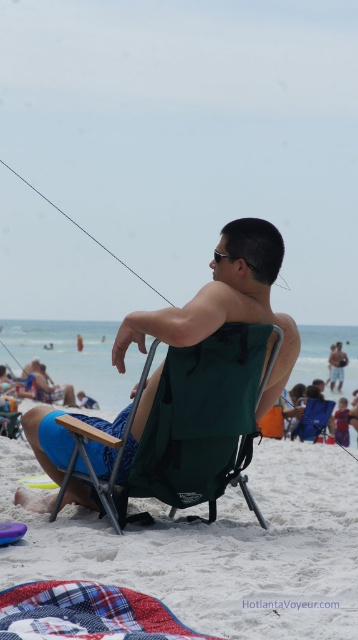
Can you confirm if blue fabric chair at center is positioned to the right of metallic wire fishing pole at upper left?

Indeed, blue fabric chair at center is positioned on the right side of metallic wire fishing pole at upper left.

Which of these two, blue fabric chair at center or metallic wire fishing pole at upper left, stands shorter?

Standing shorter between the two is blue fabric chair at center.

Who is more distant from viewer, (301, 422) or (166, 301)?

The point (301, 422) is behind.

Image resolution: width=358 pixels, height=640 pixels. I want to click on blue fabric chair at center, so click(312, 419).

Is green fabric folding chair at center in front of light blue shorts at center?

Yes, it is in front of light blue shorts at center.

Is point (260, 346) closer to camera compared to point (335, 353)?

Yes.

Does point (239, 435) come behind point (341, 372)?

No, it is in front of (341, 372).

Locate an element on the screen. green fabric folding chair at center is located at coordinates (197, 424).

Does point (157, 554) come farther from viewer compared to point (157, 497)?

No, (157, 554) is in front of (157, 497).

Can you confirm if green fabric chair at center is positioned to the right of green fabric folding chair at center?

No, green fabric chair at center is not to the right of green fabric folding chair at center.

Which is in front, point (276, 612) or point (210, 488)?

Positioned in front is point (276, 612).

Where is `green fabric chair at center`? green fabric chair at center is located at coordinates (215, 547).